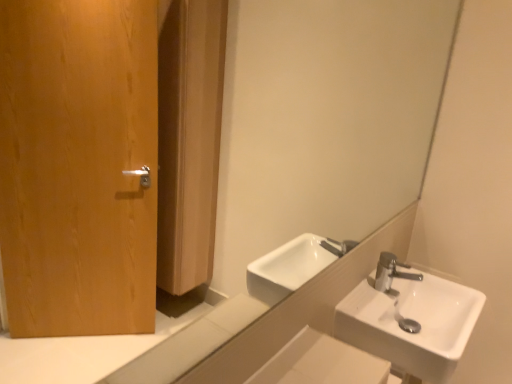
Question: Does white glossy mirror at upper center have a larger size compared to white ceramic sink at right?

Choices:
 (A) yes
 (B) no

Answer: (A)

Question: Is white glossy mirror at upper center not inside white ceramic sink at right?

Choices:
 (A) no
 (B) yes

Answer: (B)

Question: Is white glossy mirror at upper center far away from white ceramic sink at right?

Choices:
 (A) yes
 (B) no

Answer: (B)

Question: Is white glossy mirror at upper center positioned behind white ceramic sink at right?

Choices:
 (A) no
 (B) yes

Answer: (A)

Question: Is white glossy mirror at upper center taller than white ceramic sink at right?

Choices:
 (A) no
 (B) yes

Answer: (B)

Question: Does white glossy mirror at upper center appear on the left side of white ceramic sink at right?

Choices:
 (A) no
 (B) yes

Answer: (B)

Question: Is white ceramic sink at right with white glossy mirror at upper center?

Choices:
 (A) no
 (B) yes

Answer: (A)

Question: Is white ceramic sink at right bigger than white glossy mirror at upper center?

Choices:
 (A) yes
 (B) no

Answer: (B)

Question: Can you confirm if white ceramic sink at right is positioned to the right of white glossy mirror at upper center?

Choices:
 (A) yes
 (B) no

Answer: (A)

Question: Can you confirm if white ceramic sink at right is thinner than white glossy mirror at upper center?

Choices:
 (A) no
 (B) yes

Answer: (A)

Question: From the image's perspective, is white ceramic sink at right above white glossy mirror at upper center?

Choices:
 (A) yes
 (B) no

Answer: (B)

Question: Can you confirm if white ceramic sink at right is shorter than white glossy mirror at upper center?

Choices:
 (A) yes
 (B) no

Answer: (A)

Question: From the image's perspective, is white glossy mirror at upper center located above or below white ceramic sink at right?

Choices:
 (A) below
 (B) above

Answer: (B)